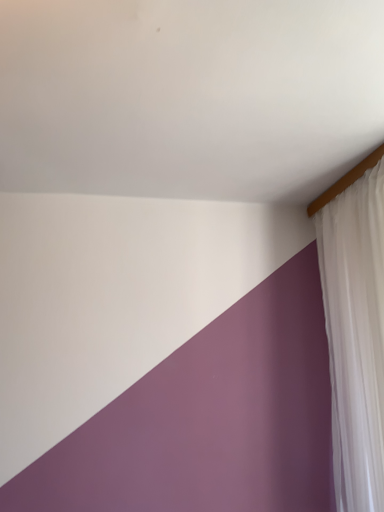
This screenshot has height=512, width=384. Describe the element at coordinates (355, 336) in the screenshot. I see `white sheer curtain at upper right` at that location.

The height and width of the screenshot is (512, 384). I want to click on white sheer curtain at upper right, so click(x=355, y=336).

Where is `white sheer curtain at upper right`? This screenshot has width=384, height=512. white sheer curtain at upper right is located at coordinates (355, 336).